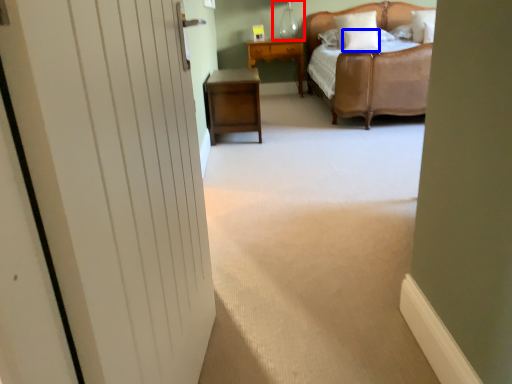
Question: Among these objects, which one is nearest to the camera, table lamp (highlighted by a red box) or pillow (highlighted by a blue box)?

Choices:
 (A) table lamp
 (B) pillow

Answer: (B)